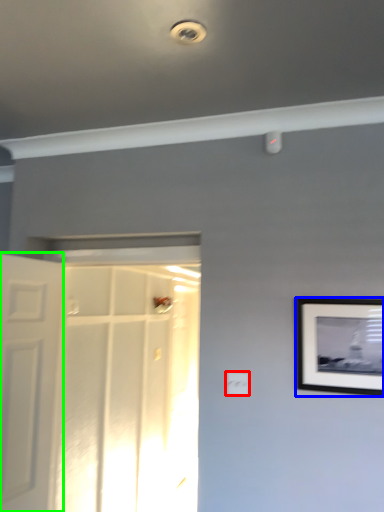
Question: Which object is the closest to the electric outlet (highlighted by a red box)? Choose among these: picture frame (highlighted by a blue box) or door (highlighted by a green box).

Choices:
 (A) picture frame
 (B) door

Answer: (A)